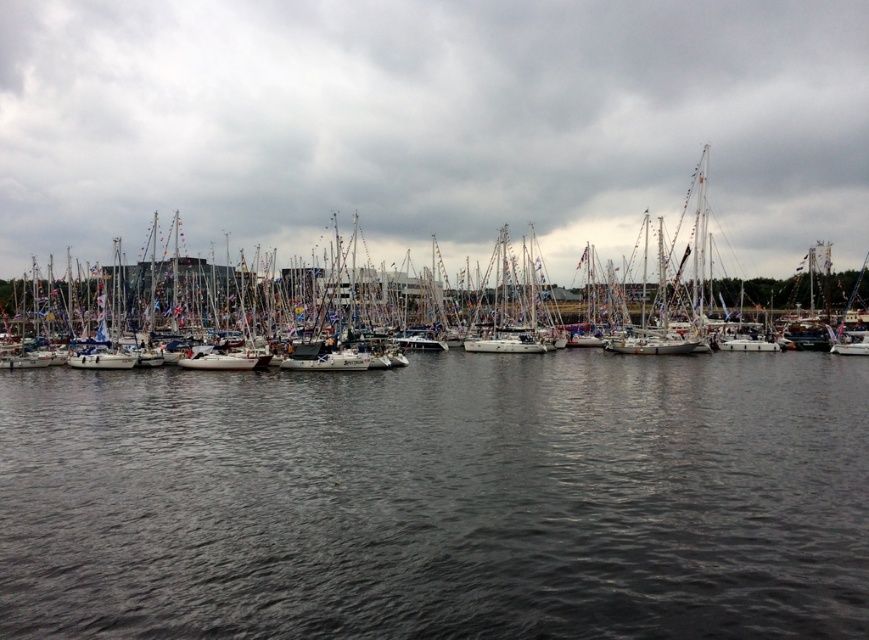
You are standing at the edge of the marina and want to locate the dark gray water at center. According to the coordinates provided, where would you look relative to the center of the image?

The dark gray water at center is located at coordinates point (440, 499), which is slightly to the right and just below the center of the image.

You are a photographer standing at the edge of the marina, aiming to capture a clear shot of the white matte sailboat at center without the dark gray water at center obstructing the view. Is this possible given their positions?

The dark gray water at center is in front of the white matte sailboat at center, so it would obstruct the view of the sailboat. To capture a clear shot, you would need to adjust your position to avoid the water blocking the sailboat.